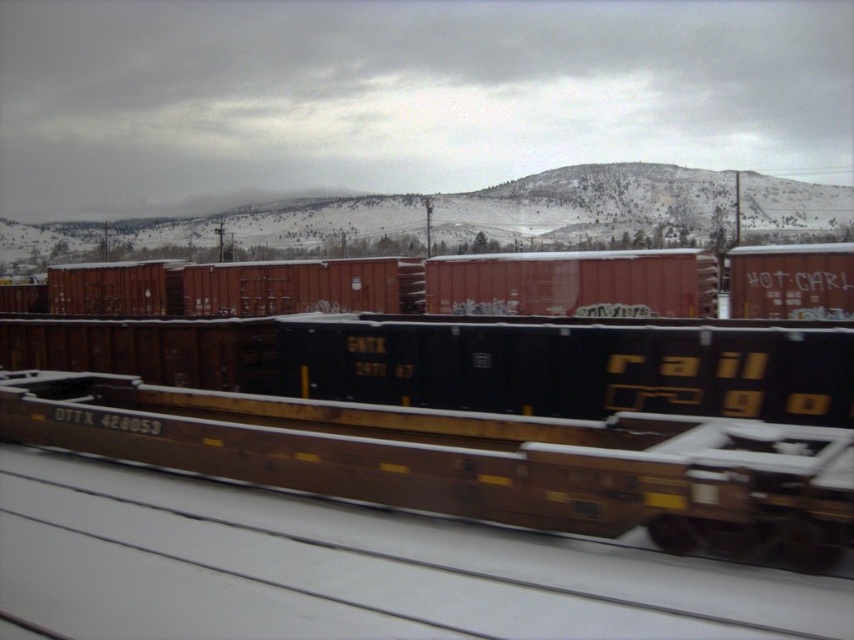
Question: Which of the following is the farthest from the observer?

Choices:
 (A) (793, 529)
 (B) (206, 307)
 (C) (39, 349)

Answer: (B)

Question: Which is farther from the matte red container at center?

Choices:
 (A) rusty metal train car at center
 (B) brown matte train car at center

Answer: (B)

Question: Where is rusty metal train car at center located in relation to matte red container at center in the image?

Choices:
 (A) above
 (B) below

Answer: (B)

Question: Estimate the real-world distances between objects in this image. Which object is farther from the matte red container at center?

Choices:
 (A) brown matte train car at center
 (B) rusty metal train car at center

Answer: (A)

Question: Can you confirm if brown matte train car at center is smaller than rusty metal train car at center?

Choices:
 (A) yes
 (B) no

Answer: (A)

Question: Can you confirm if rusty metal train car at center is positioned to the right of matte red container at center?

Choices:
 (A) no
 (B) yes

Answer: (B)